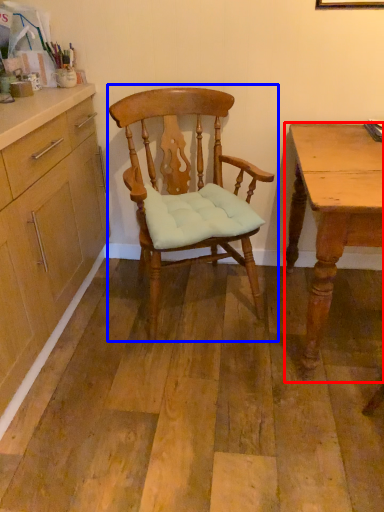
Question: Which point is further to the camera, desk (highlighted by a red box) or chair (highlighted by a blue box)?

Choices:
 (A) desk
 (B) chair

Answer: (B)